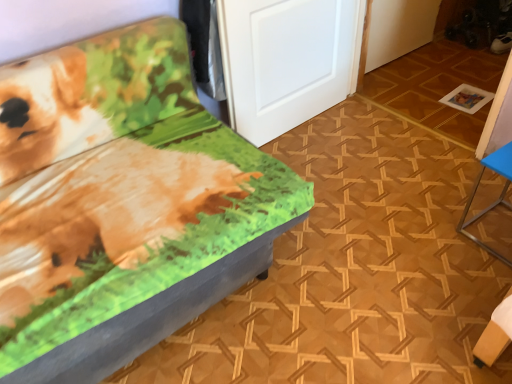
Identify the location of empty space that is in between white matte door at center and blue metallic table at right, which is the 2th furniture from left to right. This screenshot has height=384, width=512. (385, 170).